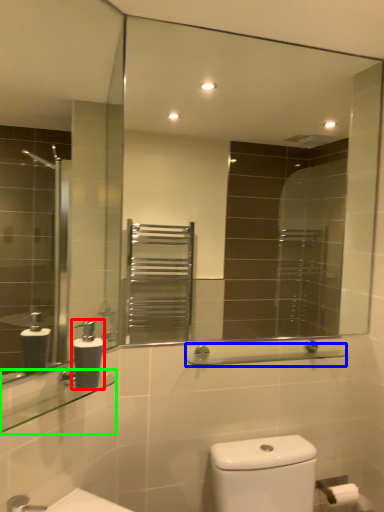
Question: Considering the real-world distances, which object is farthest from soap dispenser (highlighted by a red box)? balustrade (highlighted by a blue box) or balustrade (highlighted by a green box)?

Choices:
 (A) balustrade
 (B) balustrade

Answer: (A)